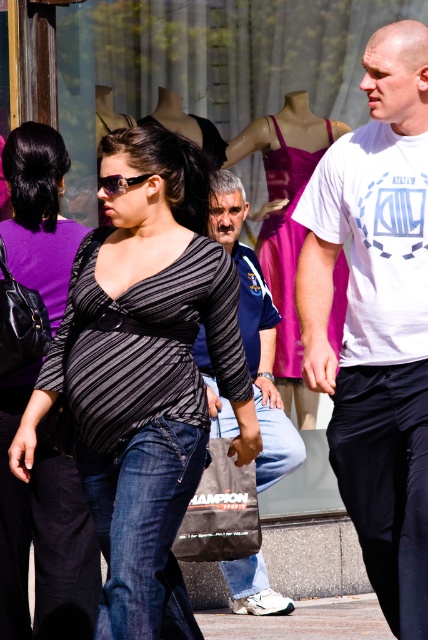
Question: Estimate the real-world distances between objects in this image. Which object is farther from the jeans at center?

Choices:
 (A) striped jersey at center
 (B) white cotton t-shirt at center

Answer: (B)

Question: Estimate the real-world distances between objects in this image. Which object is farther from the striped jersey at center?

Choices:
 (A) blue cotton shirt at center
 (B) white cotton t-shirt at center

Answer: (A)

Question: Considering the relative positions of white cotton t-shirt at center and shiny black sunglasses at center in the image provided, where is white cotton t-shirt at center located with respect to shiny black sunglasses at center?

Choices:
 (A) below
 (B) above

Answer: (A)

Question: Which point is farther to the camera?

Choices:
 (A) jeans at center
 (B) striped fabric shirt at center

Answer: (A)

Question: Can you confirm if white cotton t-shirt at center is bigger than striped fabric dress at center?

Choices:
 (A) yes
 (B) no

Answer: (A)

Question: Is denim jeans at center below striped fabric dress at center?

Choices:
 (A) no
 (B) yes

Answer: (B)